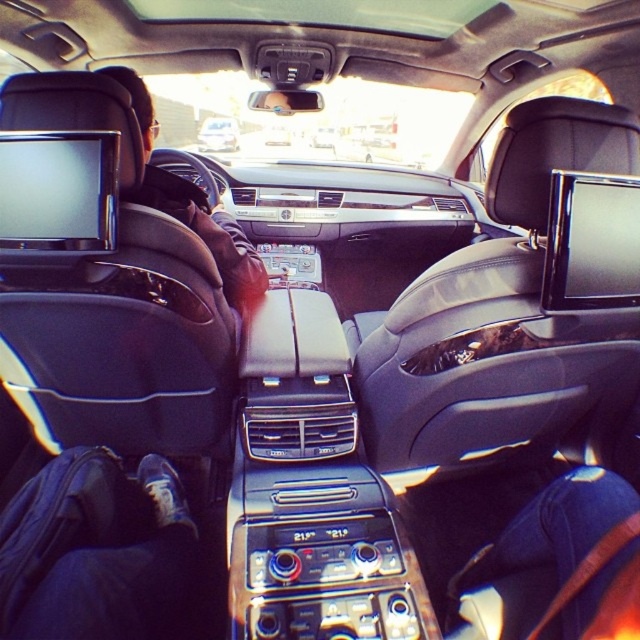
Can you confirm if leather jacket at left is taller than metallic silver car at center?

Yes, leather jacket at left is taller than metallic silver car at center.

In order to click on leather jacket at left in this screenshot , I will do `click(193, 205)`.

The image size is (640, 640). In order to click on leather jacket at left in this screenshot , I will do `click(193, 205)`.

Locate an element on the screen. This screenshot has width=640, height=640. leather jacket at left is located at coordinates (193, 205).